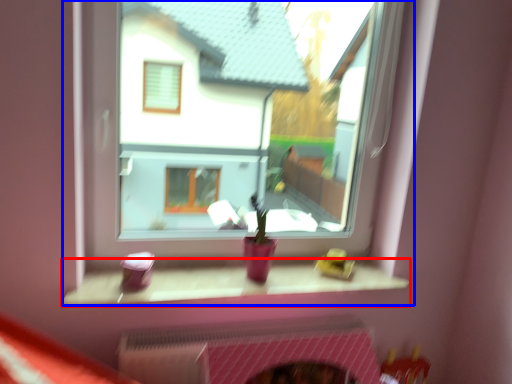
Question: Which object appears farthest to the camera in this image, window sill (highlighted by a red box) or window (highlighted by a blue box)?

Choices:
 (A) window sill
 (B) window

Answer: (A)